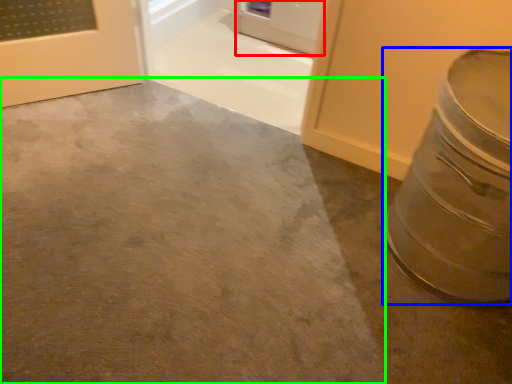
Question: Which is nearer to the door (highlighted by a red box)? crock pot (highlighted by a blue box) or concrete (highlighted by a green box).

Choices:
 (A) crock pot
 (B) concrete

Answer: (B)